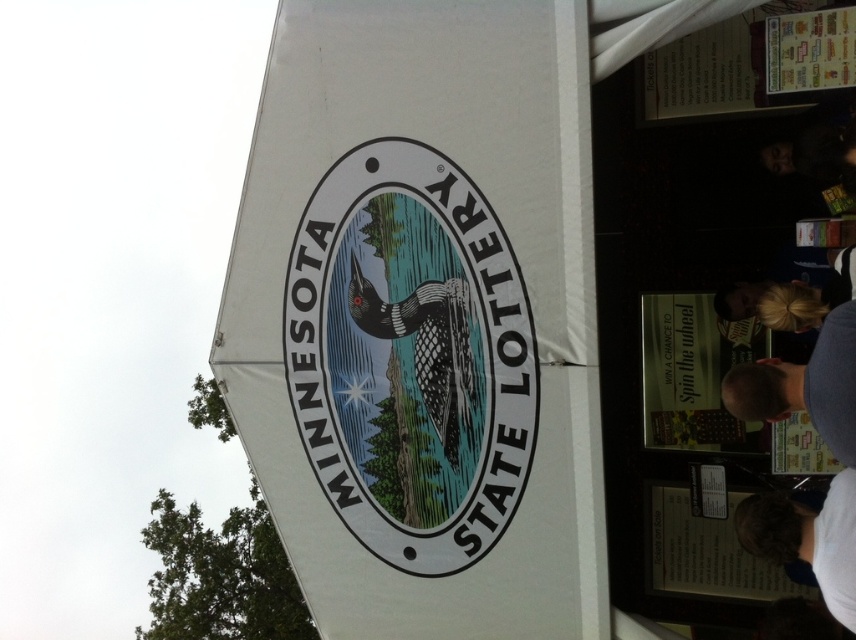
Measure the distance between blue shirt at right and camera.

The distance of blue shirt at right from camera is 10.82 meters.

Can you confirm if blue shirt at right is smaller than white t-shirt at lower right?

Yes, blue shirt at right is smaller than white t-shirt at lower right.

Between point (755, 400) and point (779, 525), which one is positioned in front?

Point (755, 400)

Find the location of `blue shirt at right`. blue shirt at right is located at coordinates (805, 385).

Does wooden signboard at center have a greater height compared to white t-shirt at lower right?

Indeed, wooden signboard at center has a greater height compared to white t-shirt at lower right.

This screenshot has height=640, width=856. Identify the location of wooden signboard at center. pyautogui.click(x=409, y=356).

How distant is white fabric canopy at center from wooden signboard at center?

They are 3.10 meters apart.

Who is more distant from viewer, (x=503, y=384) or (x=306, y=314)?

The point (x=306, y=314) is more distant.

Between point (455, 490) and point (526, 355), which one is positioned behind?

Positioned behind is point (455, 490).

Identify the location of white fabric canopy at center. (423, 317).